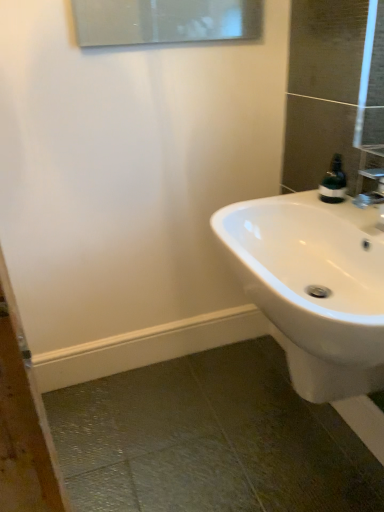
You are a GUI agent. You are given a task and a screenshot of the screen. Output one action in this format:
    pyautogui.click(x=<x>, y=<y>)
    Task: Click on the white glossy sink at lower right
    Image resolution: width=384 pixels, height=512 pixels.
    Given the screenshot: What is the action you would take?
    pyautogui.click(x=313, y=287)

The width and height of the screenshot is (384, 512). What do you see at coordinates (313, 287) in the screenshot? I see `white glossy sink at lower right` at bounding box center [313, 287].

Locate an element on the screen. The height and width of the screenshot is (512, 384). green matte soap dispenser at upper right is located at coordinates (334, 182).

Image resolution: width=384 pixels, height=512 pixels. Describe the element at coordinates (334, 182) in the screenshot. I see `green matte soap dispenser at upper right` at that location.

Find the location of a particular element. The image size is (384, 512). white glossy sink at lower right is located at coordinates (313, 287).

Between green matte soap dispenser at upper right and white glossy sink at lower right, which one appears on the right side from the viewer's perspective?

green matte soap dispenser at upper right.

Is the position of green matte soap dispenser at upper right less distant than that of white glossy sink at lower right?

No.

Between point (327, 181) and point (293, 337), which one is positioned in front?

Positioned in front is point (293, 337).

From the image's perspective, who appears lower, green matte soap dispenser at upper right or white glossy sink at lower right?

white glossy sink at lower right.

Looking at this image, from a real-world perspective, does green matte soap dispenser at upper right stand above white glossy sink at lower right?

Yes, from a real-world perspective, green matte soap dispenser at upper right is above white glossy sink at lower right.

Which object is wider, green matte soap dispenser at upper right or white glossy sink at lower right?

With larger width is white glossy sink at lower right.

Considering the sizes of green matte soap dispenser at upper right and white glossy sink at lower right in the image, is green matte soap dispenser at upper right taller or shorter than white glossy sink at lower right?

Clearly, green matte soap dispenser at upper right is shorter compared to white glossy sink at lower right.

Can you confirm if green matte soap dispenser at upper right is smaller than white glossy sink at lower right?

Yes.

Is white glossy sink at lower right completely or partially inside green matte soap dispenser at upper right?

That's incorrect, white glossy sink at lower right is not inside green matte soap dispenser at upper right.

Is green matte soap dispenser at upper right beside white glossy sink at lower right?

green matte soap dispenser at upper right is not next to white glossy sink at lower right, and they're not touching.

Is green matte soap dispenser at upper right turned away from white glossy sink at lower right?

green matte soap dispenser at upper right is not turned away from white glossy sink at lower right.

How many degrees apart are the facing directions of green matte soap dispenser at upper right and white glossy sink at lower right?

There is a 3.4-degree angle between the facing directions of green matte soap dispenser at upper right and white glossy sink at lower right.

The width and height of the screenshot is (384, 512). Find the location of `sink in front of the green matte soap dispenser at upper right`. sink in front of the green matte soap dispenser at upper right is located at coordinates (313, 287).

Considering the positions of objects white glossy sink at lower right and green matte soap dispenser at upper right in the image provided, who is more to the left, white glossy sink at lower right or green matte soap dispenser at upper right?

white glossy sink at lower right is more to the left.

Looking at this image, is the position of white glossy sink at lower right less distant than that of green matte soap dispenser at upper right?

Yes.

Considering the positions of point (228, 259) and point (335, 202), is point (228, 259) closer or farther from the camera than point (335, 202)?

Point (228, 259) is positioned closer to the camera compared to point (335, 202).

From the image's perspective, between white glossy sink at lower right and green matte soap dispenser at upper right, which one is located above?

From the image's view, green matte soap dispenser at upper right is above.

From a real-world perspective, is white glossy sink at lower right located higher than green matte soap dispenser at upper right?

No, from a real-world perspective, white glossy sink at lower right is not above green matte soap dispenser at upper right.

Considering the sizes of objects white glossy sink at lower right and green matte soap dispenser at upper right in the image provided, who is wider, white glossy sink at lower right or green matte soap dispenser at upper right?

With larger width is white glossy sink at lower right.

Is white glossy sink at lower right taller or shorter than green matte soap dispenser at upper right?

Clearly, white glossy sink at lower right is taller compared to green matte soap dispenser at upper right.

Is white glossy sink at lower right bigger than green matte soap dispenser at upper right?

Yes.

Is white glossy sink at lower right not within green matte soap dispenser at upper right?

Yes, white glossy sink at lower right is outside of green matte soap dispenser at upper right.

Would you say white glossy sink at lower right is a long distance from green matte soap dispenser at upper right?

white glossy sink at lower right is actually quite close to green matte soap dispenser at upper right.

Is white glossy sink at lower right positioned with its back to green matte soap dispenser at upper right?

No, white glossy sink at lower right is not facing away from green matte soap dispenser at upper right.

How many degrees apart are the facing directions of white glossy sink at lower right and green matte soap dispenser at upper right?

white glossy sink at lower right and green matte soap dispenser at upper right are facing 3.4 degrees away from each other.

Measure the distance between white glossy sink at lower right and green matte soap dispenser at upper right.

white glossy sink at lower right and green matte soap dispenser at upper right are 11.52 inches apart from each other.

This screenshot has height=512, width=384. In the image, there is a green matte soap dispenser at upper right. What are the coordinates of `sink below it (from a real-world perspective)` in the screenshot? It's located at (313, 287).

This screenshot has width=384, height=512. In order to click on soap dispenser above the white glossy sink at lower right (from a real-world perspective) in this screenshot , I will do `click(334, 182)`.

In order to click on soap dispenser on the right of the white glossy sink at lower right in this screenshot , I will do click(334, 182).